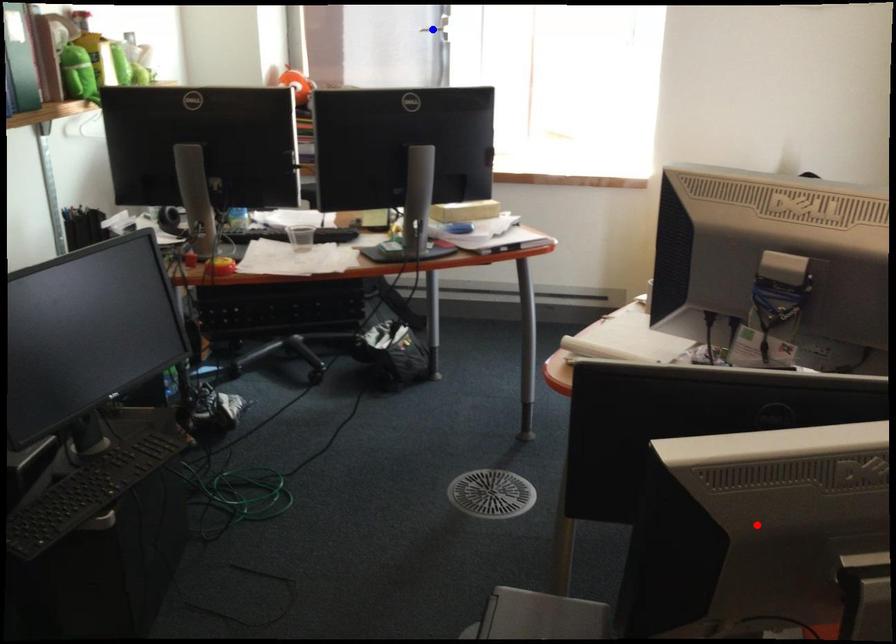
Question: Two points are marked on the image. Which point is closer to the camera?

Choices:
 (A) Blue point is closer.
 (B) Red point is closer.

Answer: (B)